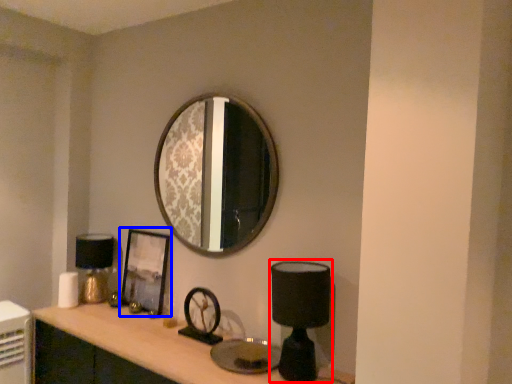
Question: Which object appears closest to the camera in this image, table lamp (highlighted by a red box) or picture frame (highlighted by a blue box)?

Choices:
 (A) table lamp
 (B) picture frame

Answer: (A)